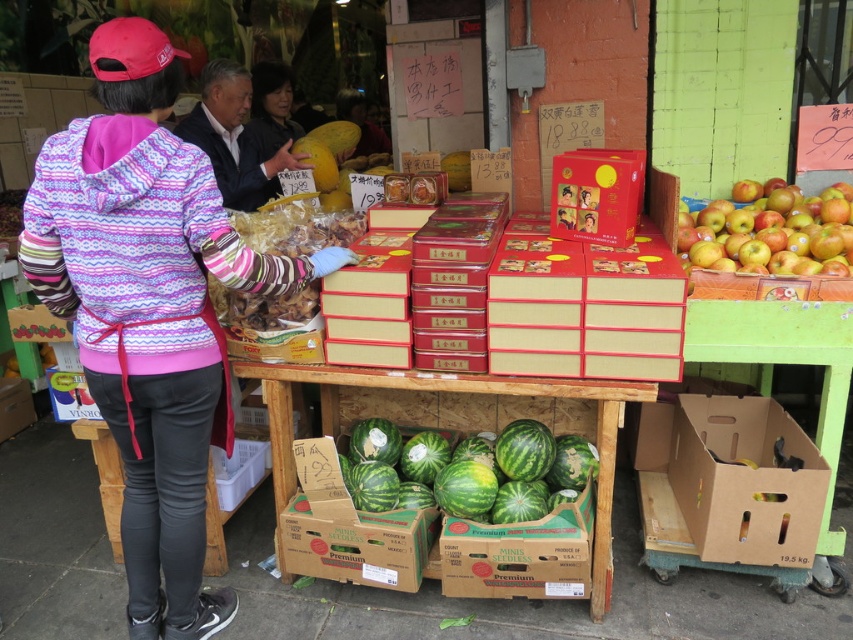
The image size is (853, 640). In order to click on pink fleece jacket at left in this screenshot , I will do click(149, 308).

The image size is (853, 640). What do you see at coordinates (149, 308) in the screenshot?
I see `pink fleece jacket at left` at bounding box center [149, 308].

Locate an element on the screen. This screenshot has width=853, height=640. pink fleece jacket at left is located at coordinates (149, 308).

Does brown cardboard boxes at center have a larger size compared to cardboard box at lower right?

Correct, brown cardboard boxes at center is larger in size than cardboard box at lower right.

From the picture: Who is more forward, (604,572) or (827,440)?

Point (604,572) is in front.

Is point (595, 504) positioned after point (816, 340)?

Yes.

Locate an element on the screen. brown cardboard boxes at center is located at coordinates (453, 426).

Can you confirm if cardboard box at lower right is smaller than green cardboard box at lower center?

Incorrect, cardboard box at lower right is not smaller in size than green cardboard box at lower center.

Between cardboard box at lower right and green cardboard box at lower center, which one is positioned lower?

green cardboard box at lower center is below.

Is point (799, 337) less distant than point (552, 531)?

No.

I want to click on cardboard box at lower right, so pos(782,364).